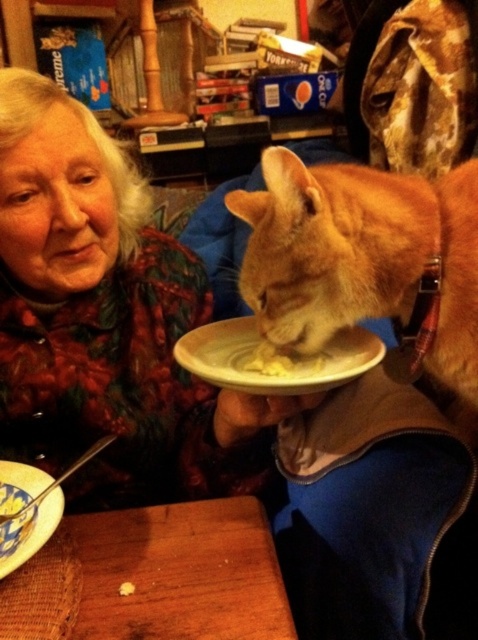
Question: Considering the relative positions of orange fur cat at center and blue glazed bowl at lower left in the image provided, where is orange fur cat at center located with respect to blue glazed bowl at lower left?

Choices:
 (A) below
 (B) above

Answer: (B)

Question: Which of the following is the closest to the observer?

Choices:
 (A) (1, 502)
 (B) (365, 252)
 (C) (212, 365)

Answer: (B)

Question: Is wooden table at lower left above yellow creamy food at plate center?

Choices:
 (A) yes
 (B) no

Answer: (B)

Question: Among these objects, which one is farthest from the camera?

Choices:
 (A) blue glazed bowl at lower left
 (B) blue and yellow ceramic bowl at lower left
 (C) orange fur cat at center
 (D) wooden table at lower left

Answer: (A)

Question: Is blue and yellow ceramic bowl at lower left positioned at the back of yellow creamy food at plate center?

Choices:
 (A) yes
 (B) no

Answer: (B)

Question: Which is farther from the blue glazed bowl at lower left?

Choices:
 (A) blue and yellow ceramic bowl at lower left
 (B) white matte plate at center

Answer: (B)